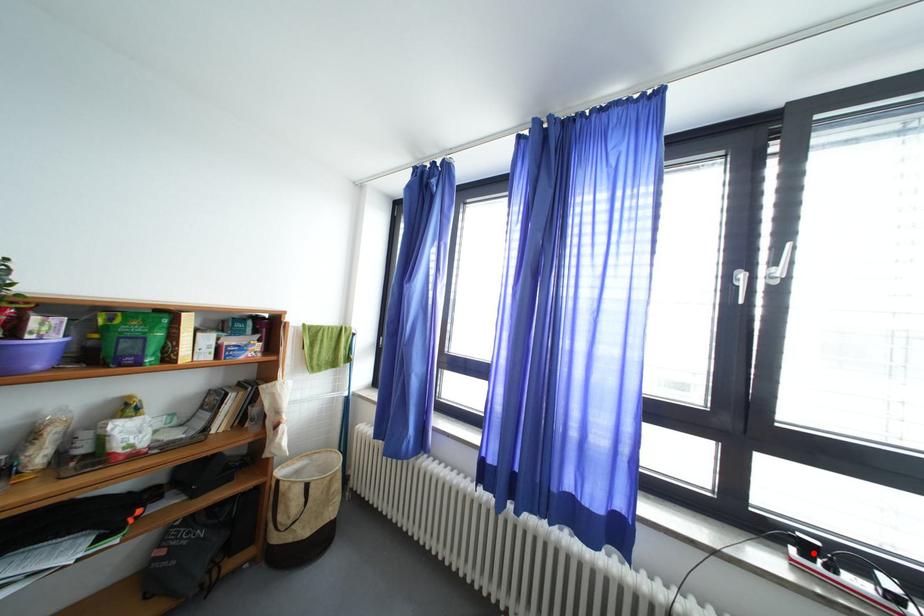
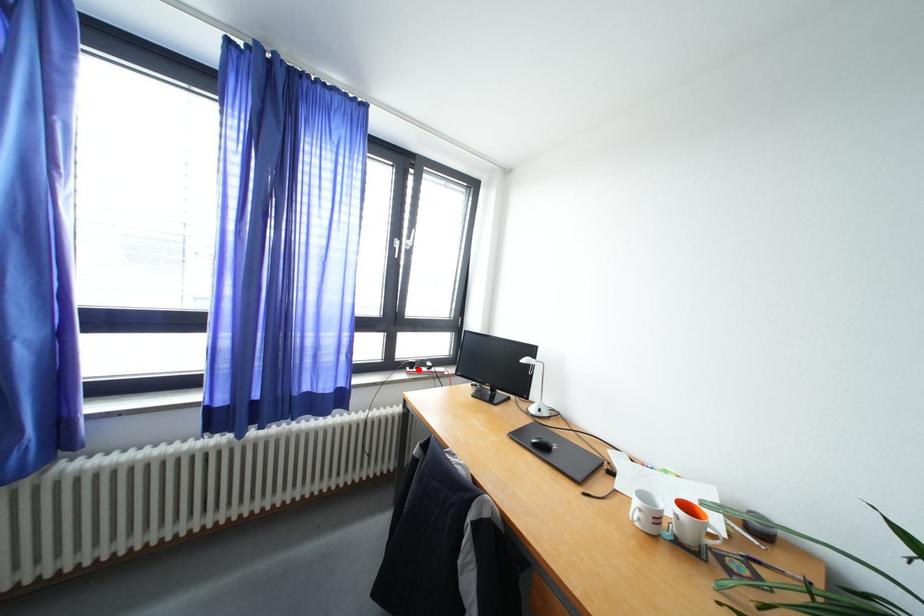
I am providing you with two images of the same scene from different viewpoints. A red point is marked on the first image and another point is marked on the second image. Is the red point in image1 aligned with the point shown in image2?

Yes